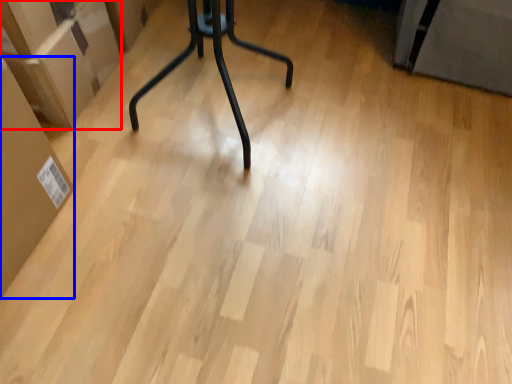
Question: Which point is closer to the camera, cardboard box (highlighted by a red box) or cardboard box (highlighted by a blue box)?

Choices:
 (A) cardboard box
 (B) cardboard box

Answer: (B)